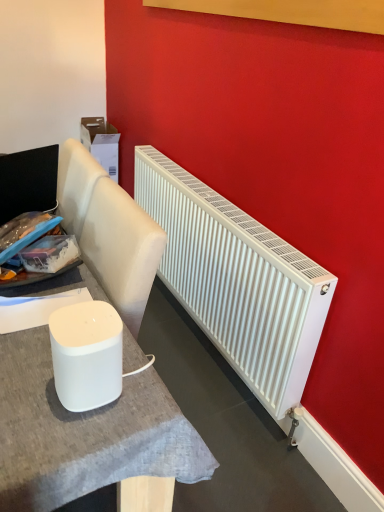
Question: Is white matte table at center far from white matte radiator at right?

Choices:
 (A) no
 (B) yes

Answer: (A)

Question: From a real-world perspective, is white matte table at center below white matte radiator at right?

Choices:
 (A) yes
 (B) no

Answer: (A)

Question: Considering the relative sizes of white matte table at center and white matte radiator at right in the image provided, is white matte table at center smaller than white matte radiator at right?

Choices:
 (A) yes
 (B) no

Answer: (B)

Question: Is white matte table at center located outside white matte radiator at right?

Choices:
 (A) yes
 (B) no

Answer: (A)

Question: Considering the relative positions of white matte table at center and white matte radiator at right in the image provided, is white matte table at center behind white matte radiator at right?

Choices:
 (A) yes
 (B) no

Answer: (B)

Question: Does white matte table at center have a larger size compared to white matte radiator at right?

Choices:
 (A) yes
 (B) no

Answer: (A)

Question: From the image's perspective, is white matte radiator at right located beneath white matte table at center?

Choices:
 (A) yes
 (B) no

Answer: (B)

Question: Can you confirm if white matte radiator at right is positioned to the right of white matte table at center?

Choices:
 (A) no
 (B) yes

Answer: (B)

Question: Does white matte radiator at right have a lesser width compared to white matte table at center?

Choices:
 (A) no
 (B) yes

Answer: (B)

Question: Is white matte radiator at right at the left side of white matte table at center?

Choices:
 (A) no
 (B) yes

Answer: (A)

Question: Is the surface of white matte radiator at right in direct contact with white matte table at center?

Choices:
 (A) no
 (B) yes

Answer: (A)

Question: Is white matte radiator at right further to the viewer compared to white matte table at center?

Choices:
 (A) no
 (B) yes

Answer: (B)

Question: Is white matte speaker at lower left touching white matte radiator at right?

Choices:
 (A) no
 (B) yes

Answer: (A)